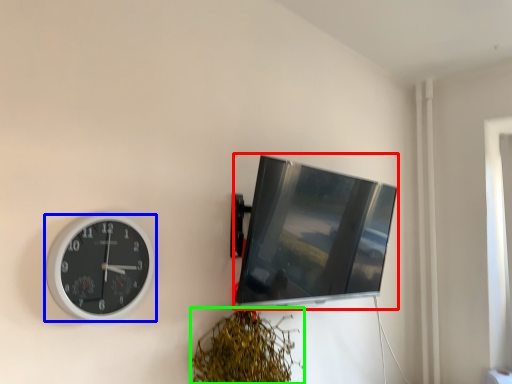
Question: Which is nearer to the computer monitor (highlighted by a red box)? wall clock (highlighted by a blue box) or vegetation (highlighted by a green box).

Choices:
 (A) wall clock
 (B) vegetation

Answer: (B)